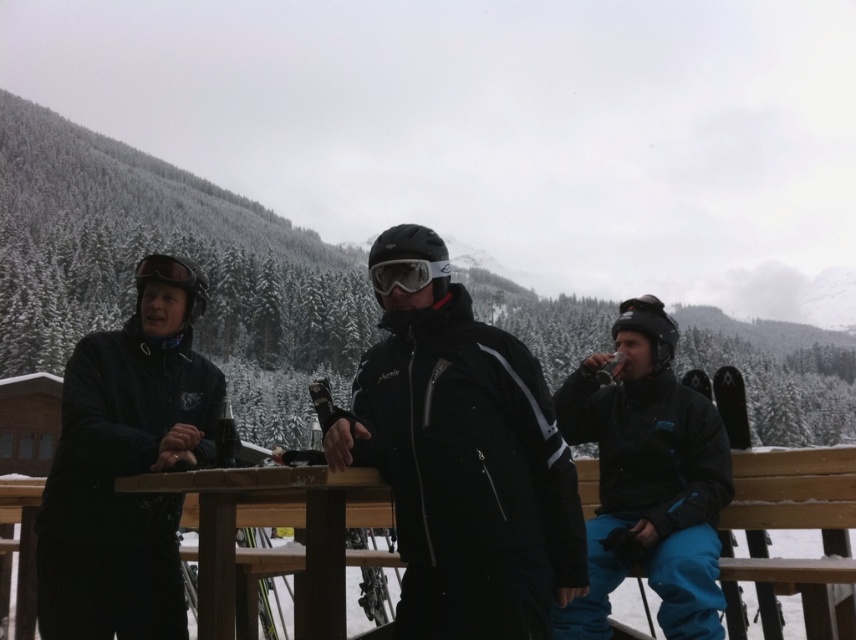
Is matte black jacket at right thinner than transparent plastic goggles at center?

Answer: Incorrect, matte black jacket at right's width is not less than transparent plastic goggles at center's.

Between matte black jacket at right and transparent plastic goggles at center, which one appears on the right side from the viewer's perspective?

matte black jacket at right

Who is more forward, [676,627] or [437,262]?

Positioned in front is point [437,262].

The height and width of the screenshot is (640, 856). Identify the location of matte black jacket at right. (649, 477).

Is matte black jacket at left smaller than matte black jacket at right?

Actually, matte black jacket at left might be larger than matte black jacket at right.

Is matte black jacket at left taller than matte black jacket at right?

Correct, matte black jacket at left is much taller as matte black jacket at right.

Does point (68, 364) come farther from viewer compared to point (629, 307)?

No, it is in front of (629, 307).

Image resolution: width=856 pixels, height=640 pixels. What are the coordinates of `matte black jacket at left` in the screenshot? It's located at (126, 465).

Between point (407, 435) and point (37, 538), which one is positioned behind?

Positioned behind is point (37, 538).

Between matte black jacket at center and matte black jacket at left, which one has less height?

matte black jacket at center is shorter.

Is point (474, 570) positioned in front of point (114, 525)?

Yes, it is in front of point (114, 525).

Locate an element on the screen. matte black jacket at center is located at coordinates (465, 470).